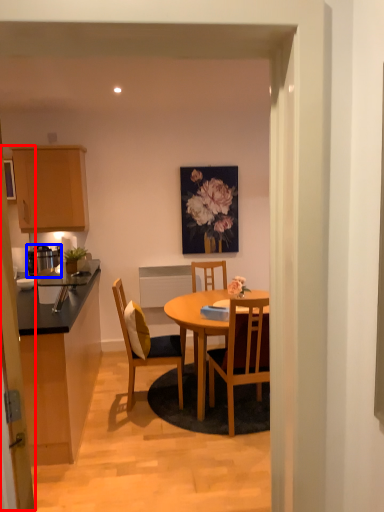
Question: Among these objects, which one is nearest to the camera, glass door (highlighted by a red box) or appliance (highlighted by a blue box)?

Choices:
 (A) glass door
 (B) appliance

Answer: (A)